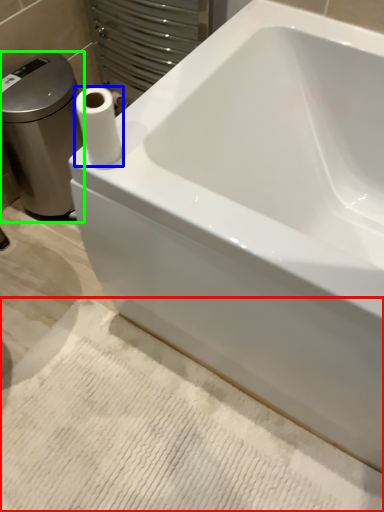
Question: Based on their relative distances, which object is farther from bath mat (highlighted by a red box)? Choose from paper towel (highlighted by a blue box) and porcelain (highlighted by a green box).

Choices:
 (A) paper towel
 (B) porcelain

Answer: (B)